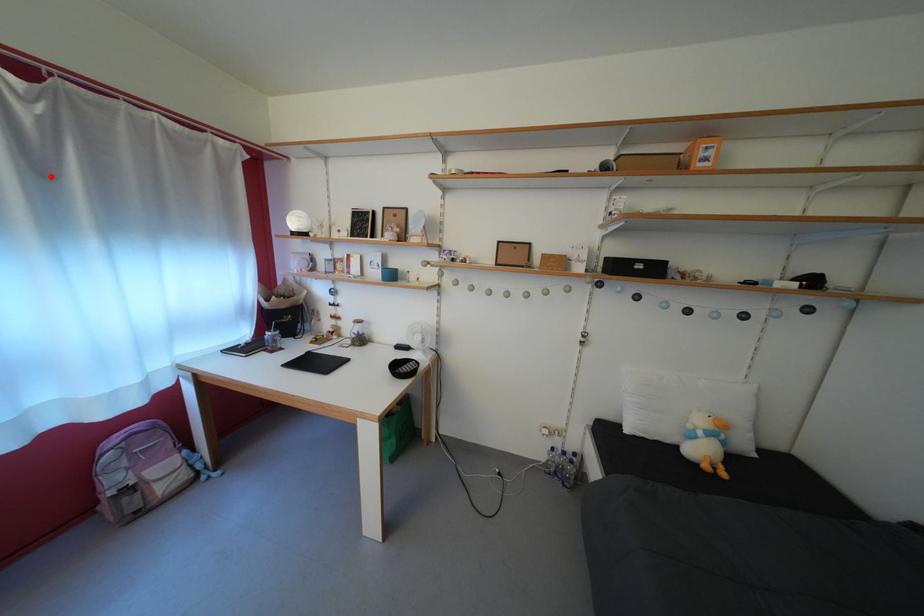
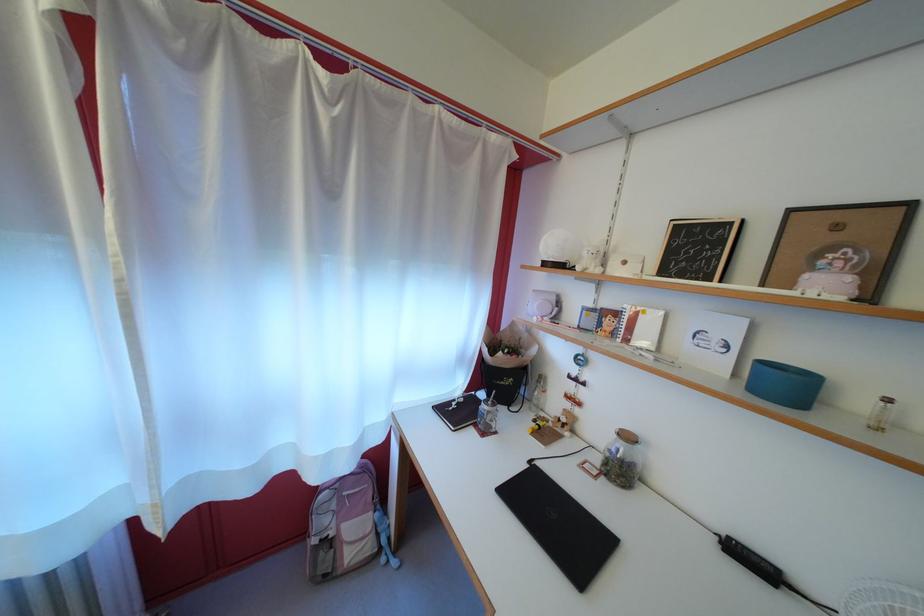
Question: I am providing you with two images of the same scene from different viewpoints. A red point is marked on the first image. Is the red point's position out of view in image 2?

Choices:
 (A) Yes
 (B) No

Answer: (B)